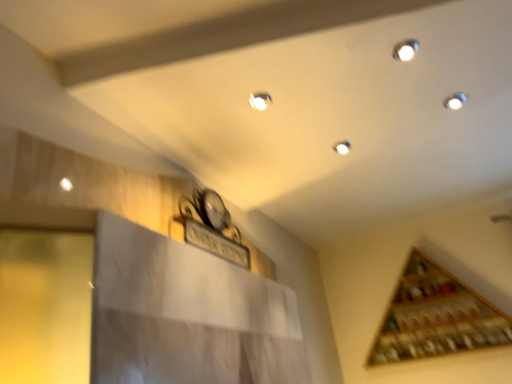
The width and height of the screenshot is (512, 384). What are the coordinates of `matte white light at upper center` in the screenshot? It's located at (260, 100).

What do you see at coordinates (260, 100) in the screenshot?
I see `matte white light at upper center` at bounding box center [260, 100].

Where is `wooden wine rack at upper right`? The image size is (512, 384). wooden wine rack at upper right is located at coordinates (436, 317).

What do you see at coordinates (436, 317) in the screenshot?
I see `wooden wine rack at upper right` at bounding box center [436, 317].

Find the location of a particular element. Image resolution: width=512 pixels, height=384 pixels. matte white light at upper center is located at coordinates (260, 100).

Based on the photo, visually, is wooden wine rack at upper right positioned to the left or to the right of matte white light at upper center?

From the image, it's evident that wooden wine rack at upper right is to the right of matte white light at upper center.

Considering their positions, is wooden wine rack at upper right located in front of or behind matte white light at upper center?

wooden wine rack at upper right is behind matte white light at upper center.

Between point (413, 336) and point (265, 101), which one is positioned behind?

The point (413, 336) is farther.

From the image's perspective, would you say wooden wine rack at upper right is positioned over matte white light at upper center?

Actually, wooden wine rack at upper right appears below matte white light at upper center in the image.

From a real-world perspective, which object rests below the other?

wooden wine rack at upper right is physically lower.

Is wooden wine rack at upper right thinner than matte white light at upper center?

No.

Considering the relative sizes of wooden wine rack at upper right and matte white light at upper center in the image provided, is wooden wine rack at upper right shorter than matte white light at upper center?

No.

Considering the relative sizes of wooden wine rack at upper right and matte white light at upper center in the image provided, is wooden wine rack at upper right smaller than matte white light at upper center?

Incorrect, wooden wine rack at upper right is not smaller in size than matte white light at upper center.

Is wooden wine rack at upper right located outside matte white light at upper center?

wooden wine rack at upper right lies outside matte white light at upper center's area.

From the picture: Are wooden wine rack at upper right and matte white light at upper center far apart?

wooden wine rack at upper right is positioned a significant distance from matte white light at upper center.

Is wooden wine rack at upper right positioned with its back to matte white light at upper center?

That's not correct — wooden wine rack at upper right is not looking away from matte white light at upper center.

How many degrees apart are the facing directions of wooden wine rack at upper right and matte white light at upper center?

There is a 92.2-degree angle between the facing directions of wooden wine rack at upper right and matte white light at upper center.

Identify the location of wine rack behind the matte white light at upper center. (436, 317).

Is matte white light at upper center to the left of wooden wine rack at upper right from the viewer's perspective?

Yes, matte white light at upper center is to the left of wooden wine rack at upper right.

Looking at this image, between matte white light at upper center and wooden wine rack at upper right, which one is positioned behind?

Positioned behind is wooden wine rack at upper right.

Does point (268, 99) lie in front of point (450, 311)?

Yes, point (268, 99) is closer to viewer.

From the image's perspective, is matte white light at upper center over wooden wine rack at upper right?

Indeed, from the image's perspective, matte white light at upper center is shown above wooden wine rack at upper right.

From a real-world perspective, is matte white light at upper center physically below wooden wine rack at upper right?

No, from a real-world perspective, matte white light at upper center is not beneath wooden wine rack at upper right.

Considering the relative sizes of matte white light at upper center and wooden wine rack at upper right in the image provided, is matte white light at upper center wider than wooden wine rack at upper right?

In fact, matte white light at upper center might be narrower than wooden wine rack at upper right.

Considering the relative sizes of matte white light at upper center and wooden wine rack at upper right in the image provided, is matte white light at upper center taller than wooden wine rack at upper right?

In fact, matte white light at upper center may be shorter than wooden wine rack at upper right.

Consider the image. Considering the sizes of objects matte white light at upper center and wooden wine rack at upper right in the image provided, who is smaller, matte white light at upper center or wooden wine rack at upper right?

matte white light at upper center.

Would you say matte white light at upper center is outside wooden wine rack at upper right?

Yes, matte white light at upper center is located beyond the bounds of wooden wine rack at upper right.

Is matte white light at upper center next to wooden wine rack at upper right and touching it?

There is a gap between matte white light at upper center and wooden wine rack at upper right.

Could you tell me if matte white light at upper center is facing wooden wine rack at upper right?

No.

Can you tell me how much matte white light at upper center and wooden wine rack at upper right differ in facing direction?

The angle between the facing direction of matte white light at upper center and the facing direction of wooden wine rack at upper right is 92.2 degrees.

Locate an element on the screen. This screenshot has width=512, height=384. light above the wooden wine rack at upper right (from a real-world perspective) is located at coordinates (260, 100).

The image size is (512, 384). I want to click on wine rack below the matte white light at upper center (from the image's perspective), so 436,317.

Where is `light above the wooden wine rack at upper right (from a real-world perspective)`? light above the wooden wine rack at upper right (from a real-world perspective) is located at coordinates (260, 100).